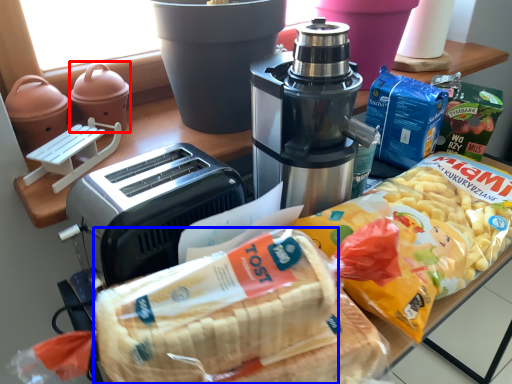
Question: Which of the following is the farthest to the observer, appliance (highlighted by a red box) or treat (highlighted by a blue box)?

Choices:
 (A) appliance
 (B) treat

Answer: (A)